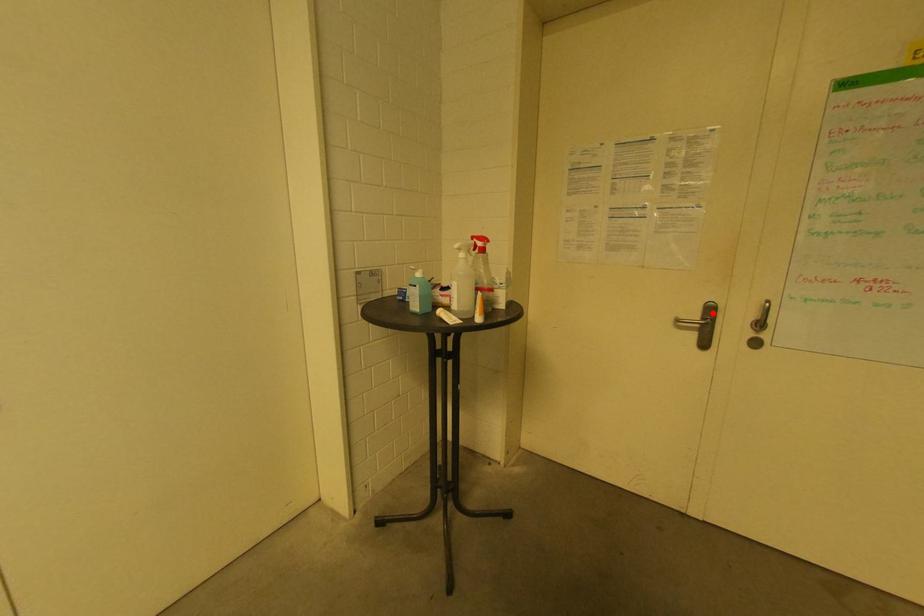
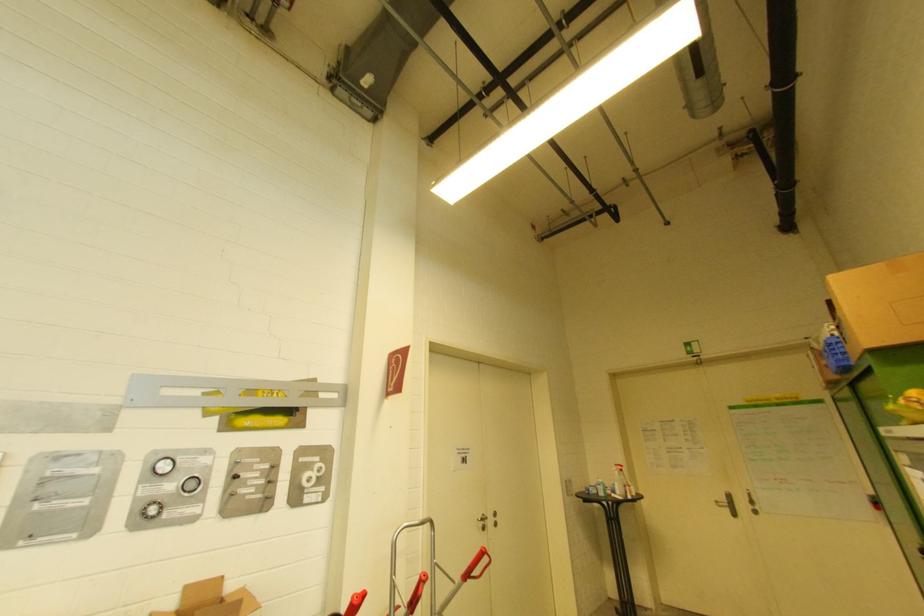
Find the pixel in the second image that matches the highlighted location in the first image.

(731, 498)